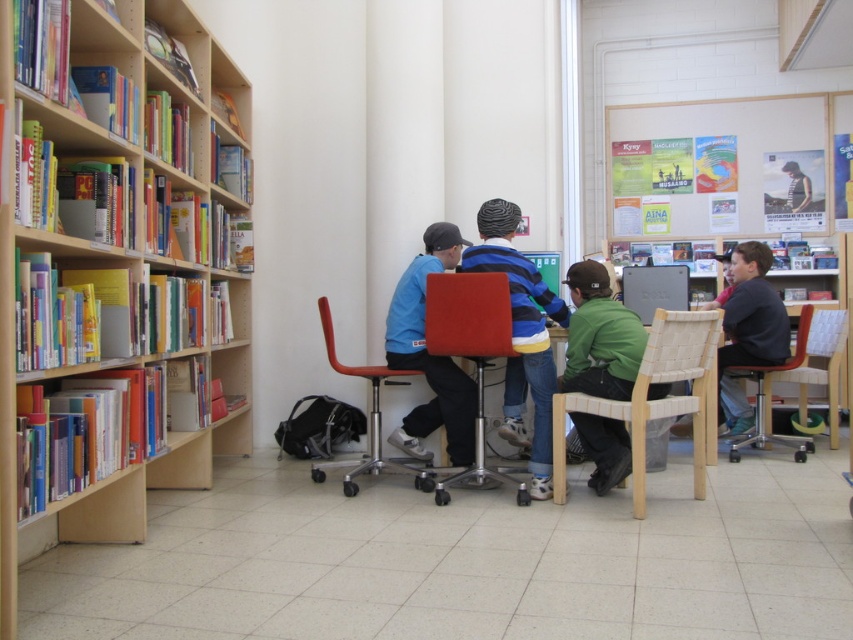
Who is taller, woven wood chair at center or matte blue shirt at center?

matte blue shirt at center

Does woven wood chair at center have a smaller size compared to matte blue shirt at center?

No, woven wood chair at center is not smaller than matte blue shirt at center.

Locate an element on the screen. woven wood chair at center is located at coordinates (x=657, y=400).

Does red fabric chair at center appear on the left side of dark gray sweater at center?

Correct, you'll find red fabric chair at center to the left of dark gray sweater at center.

Locate an element on the screen. red fabric chair at center is located at coordinates (471, 358).

Where is `red fabric chair at center`? Image resolution: width=853 pixels, height=640 pixels. red fabric chair at center is located at coordinates click(471, 358).

Between point (543, 365) and point (386, 458), which one is positioned behind?

Positioned behind is point (386, 458).

From the picture: Can you confirm if striped cotton shirt at center is wider than matte plastic chair at center?

Incorrect, striped cotton shirt at center's width does not surpass matte plastic chair at center's.

Is point (486, 244) positioned after point (347, 371)?

Yes, point (486, 244) is farther from viewer.

The width and height of the screenshot is (853, 640). I want to click on striped cotton shirt at center, so click(x=521, y=336).